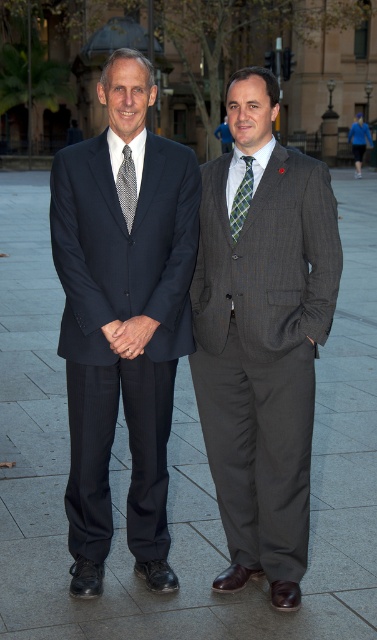
Which is in front, point (254, 282) or point (237, 216)?

Point (254, 282)

Which of these two, gray pinstripe suit at right or green plaid tie at center, stands taller?

gray pinstripe suit at right

Does point (315, 259) come closer to viewer compared to point (242, 198)?

That is False.

Identify the location of gray pinstripe suit at right. (263, 352).

Does matte black suit at center appear over gray pinstripe suit at right?

Yes, matte black suit at center is above gray pinstripe suit at right.

Which is below, matte black suit at center or gray pinstripe suit at right?

gray pinstripe suit at right is below.

Identify the location of matte black suit at center. (263, 337).

Find the location of a particular element. matte black suit at center is located at coordinates (263, 337).

Is patterned silk tie at center in front of green plaid tie at center?

Yes.

Between patterned silk tie at center and green plaid tie at center, which one is positioned lower?

green plaid tie at center

The height and width of the screenshot is (640, 377). What are the coordinates of `patterned silk tie at center` in the screenshot? It's located at (127, 188).